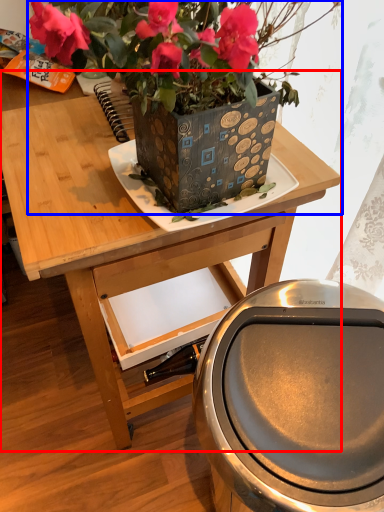
Question: Which of the following is the farthest to the observer, table (highlighted by a red box) or houseplant (highlighted by a blue box)?

Choices:
 (A) table
 (B) houseplant

Answer: (A)